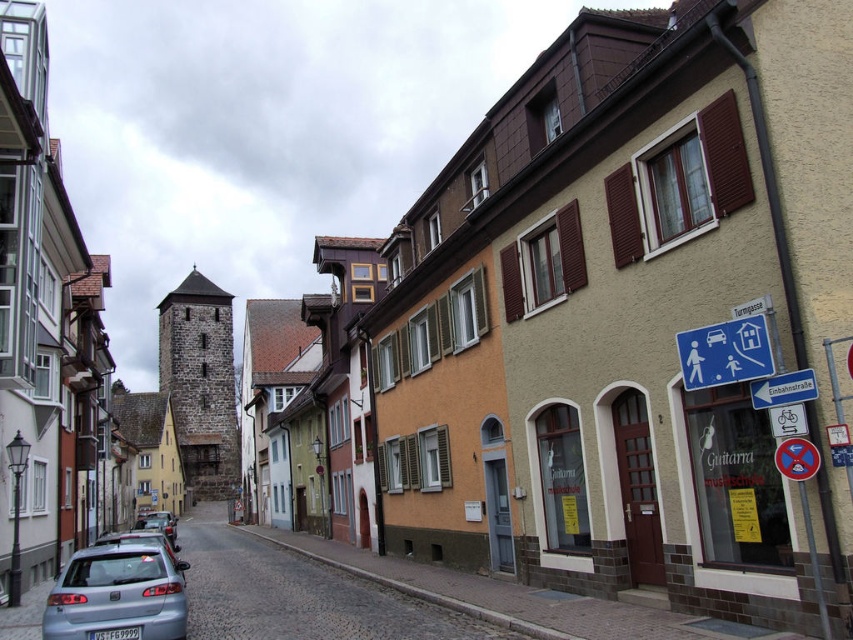
Question: Which of the following is the farthest from the observer?

Choices:
 (A) (753, 381)
 (B) (178, 570)

Answer: (B)

Question: Which object is the farthest from the metallic silver hatchback at lower left?

Choices:
 (A) blue plastic sign at center right
 (B) silver metallic car at lower left
 (C) silver metallic car at center

Answer: (C)

Question: Considering the real-world distances, which object is farthest from the silver metallic car at lower left?

Choices:
 (A) blue plastic sign at center right
 (B) silver metallic car at center
 (C) metallic silver hatchback at lower left

Answer: (A)

Question: Is blue plastic sign at center right to the right of silver metallic car at center from the viewer's perspective?

Choices:
 (A) no
 (B) yes

Answer: (B)

Question: Is metallic silver hatchback at lower left above silver metallic car at center?

Choices:
 (A) yes
 (B) no

Answer: (A)

Question: Can you confirm if metallic silver hatchback at lower left is positioned to the right of silver metallic car at lower left?

Choices:
 (A) yes
 (B) no

Answer: (A)